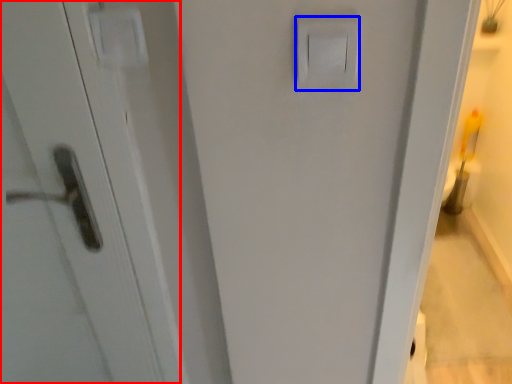
Question: Among these objects, which one is farthest to the camera, screen door (highlighted by a red box) or light switch (highlighted by a blue box)?

Choices:
 (A) screen door
 (B) light switch

Answer: (A)